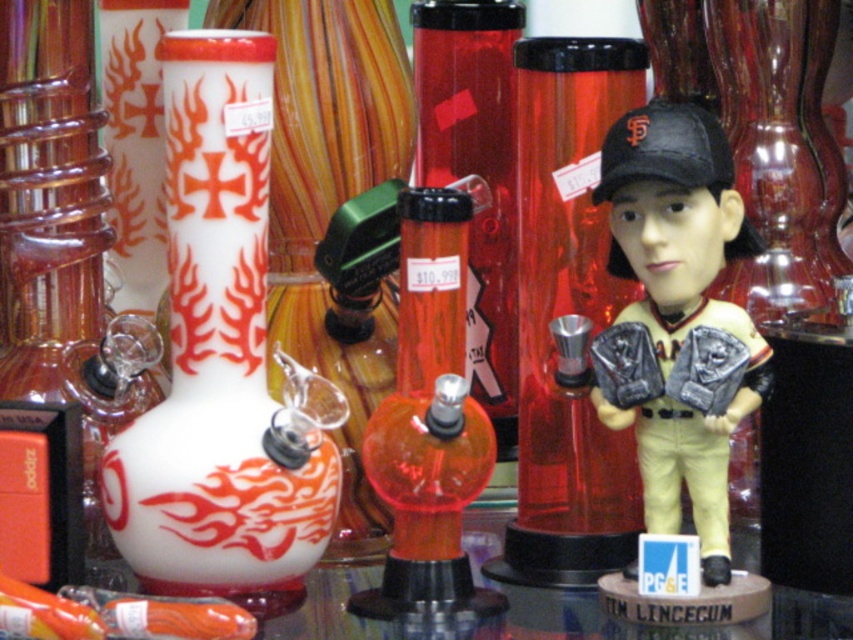
Question: Considering the real-world distances, which object is farthest from the translucent amber glass vase at center?

Choices:
 (A) white glossy bong at left
 (B) translucent orange glass bong at center

Answer: (A)

Question: Is translucent orange glass bong at center thinner than translucent amber glass vase at center?

Choices:
 (A) no
 (B) yes

Answer: (B)

Question: Estimate the real-world distances between objects in this image. Which object is closer to the translucent orange glass bong at center?

Choices:
 (A) white glossy bong at left
 (B) translucent amber glass vase at center

Answer: (A)

Question: In this image, where is white glossy bong at left located relative to translucent amber glass vase at center?

Choices:
 (A) right
 (B) left

Answer: (B)

Question: Does translucent orange glass bong at center have a larger size compared to translucent amber glass vase at center?

Choices:
 (A) no
 (B) yes

Answer: (B)

Question: Which of these objects is positioned farthest from the translucent amber glass vase at center?

Choices:
 (A) translucent orange glass bong at center
 (B) white glossy bong at left

Answer: (B)